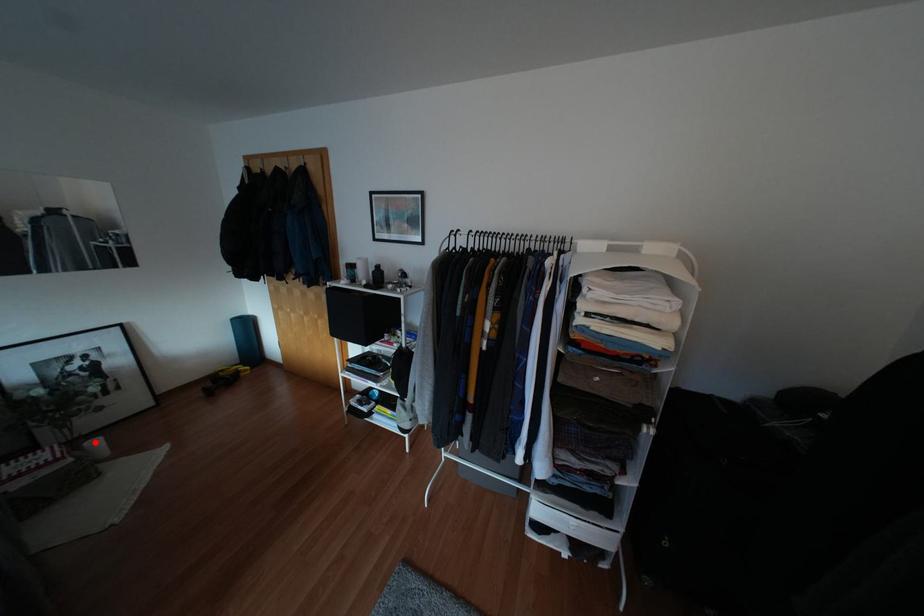
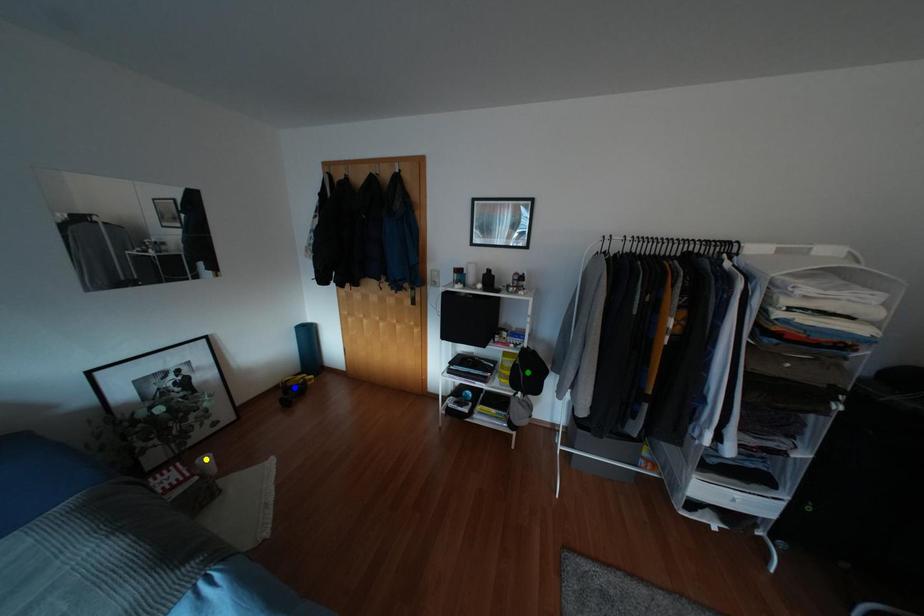
Question: I am providing you with two images of the same scene from different viewpoints. A red point is marked on the first image. You are given multiple points on the second image. Which point in image 2 is actually the same real-world point as the red point in image 1?

Choices:
 (A) green point
 (B) yellow point
 (C) blue point

Answer: (B)